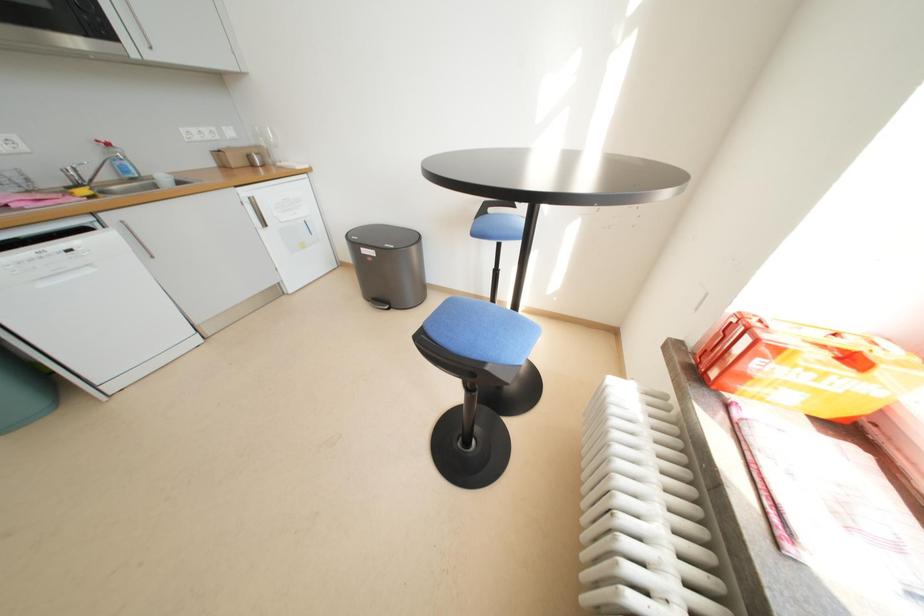
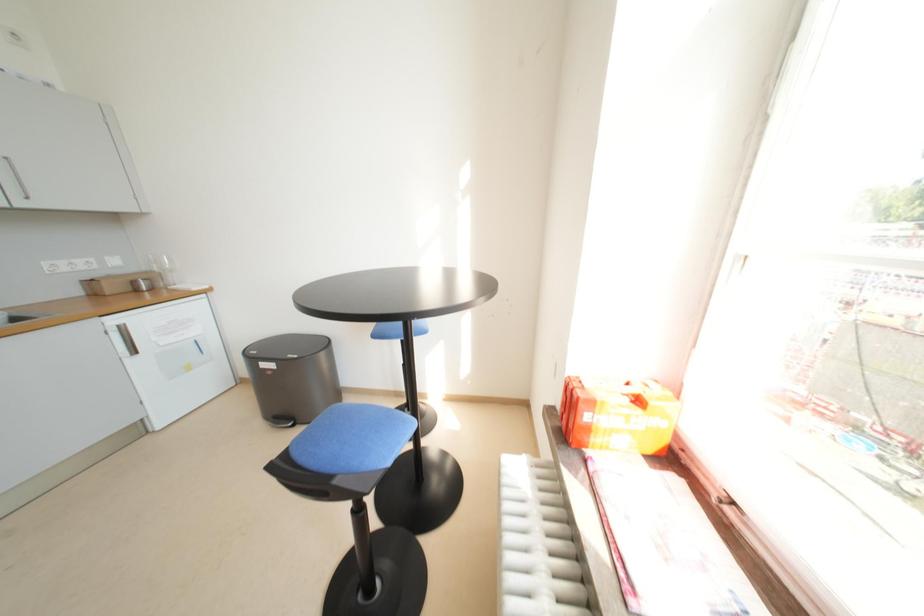
The images are taken continuously from a first-person perspective. In which direction are you moving?

The movement direction of the cameraman is right, backward.